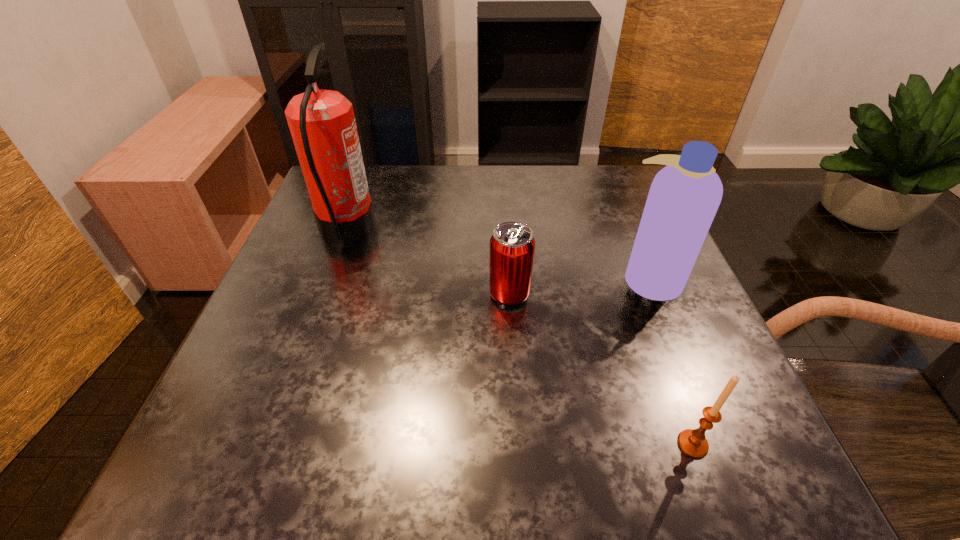
I want to click on fire extinguisher, so click(322, 124).

I want to click on the leftmost object, so click(322, 124).

I want to click on the second tallest object, so click(x=684, y=196).

What are the coordinates of `candle_holder` in the screenshot? It's located at (693, 443).

Where is `the second object from left to right`? the second object from left to right is located at coordinates (512, 246).

Where is `free space located on the front side of the fire extinguisher`? The width and height of the screenshot is (960, 540). free space located on the front side of the fire extinguisher is located at coordinates (440, 231).

The image size is (960, 540). What are the coordinates of `free space located on the back of the second tallest object` in the screenshot? It's located at (629, 228).

The width and height of the screenshot is (960, 540). Identify the location of vacant area situated on the back of the nearest object. (672, 389).

Where is `free space located 0.080m on the back of the soda can`? Image resolution: width=960 pixels, height=540 pixels. free space located 0.080m on the back of the soda can is located at coordinates (507, 254).

What are the coordinates of `object that is at the far edge` in the screenshot? It's located at (322, 124).